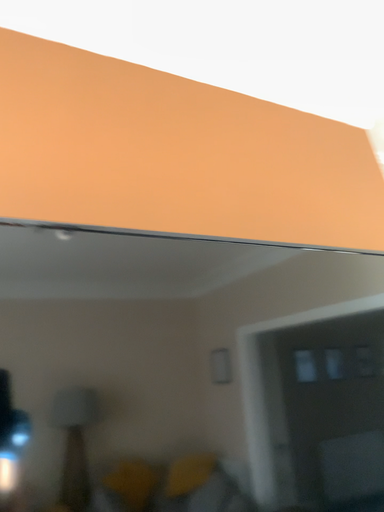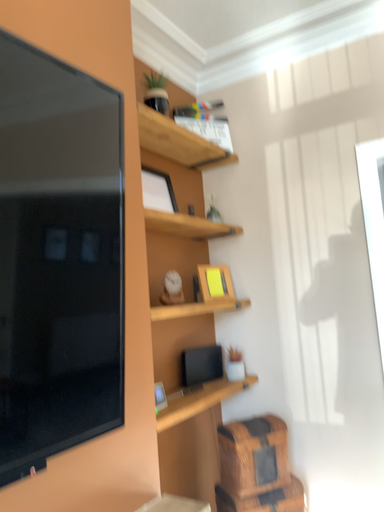
Question: How did the camera likely rotate when shooting the video?

Choices:
 (A) rotated left
 (B) rotated right

Answer: (B)